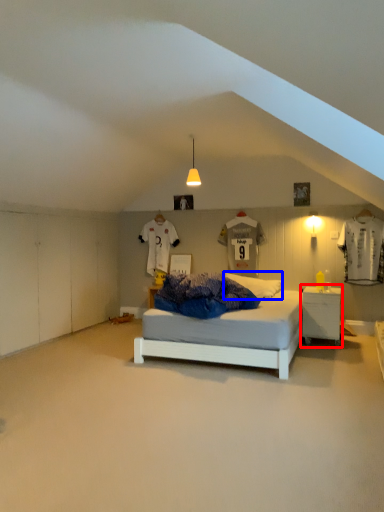
Question: Which point is closer to the camera, nightstand (highlighted by a red box) or pillow (highlighted by a blue box)?

Choices:
 (A) nightstand
 (B) pillow

Answer: (A)